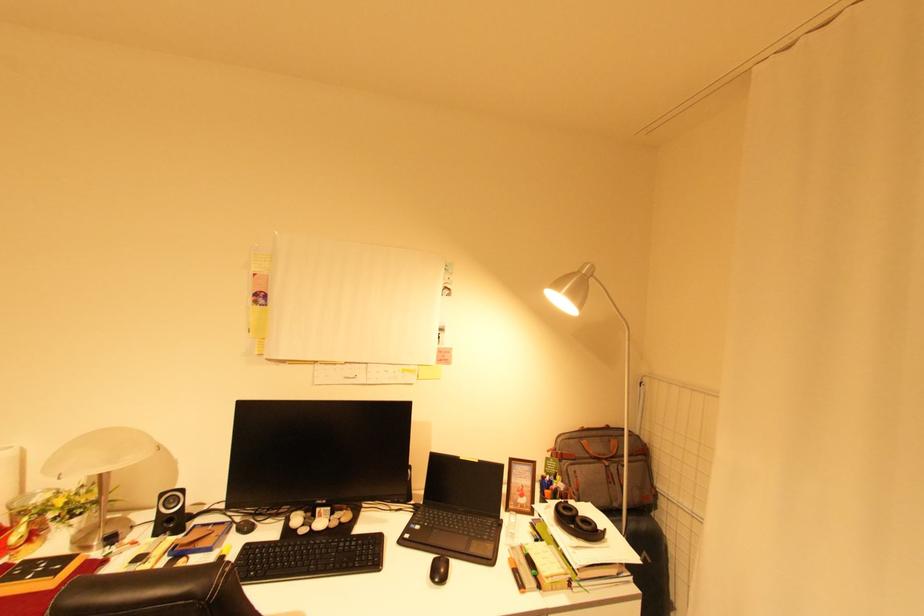
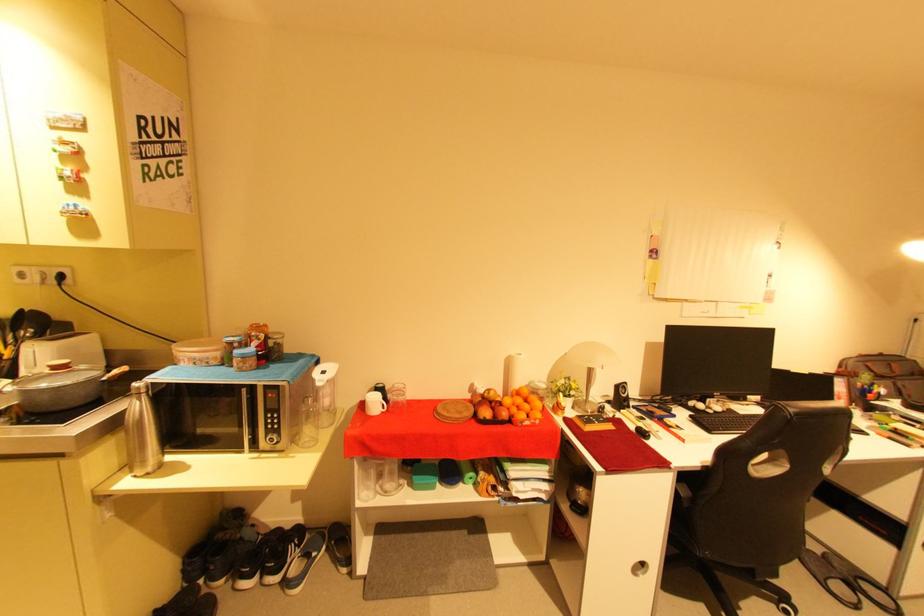
Question: I am providing you with two images of the same scene from different viewpoints. Which of the following objects are not visible in image2?

Choices:
 (A) chair sitting surface
 (B) water pitcher handle
 (C) long white pole
 (D) black computer mouse

Answer: (D)